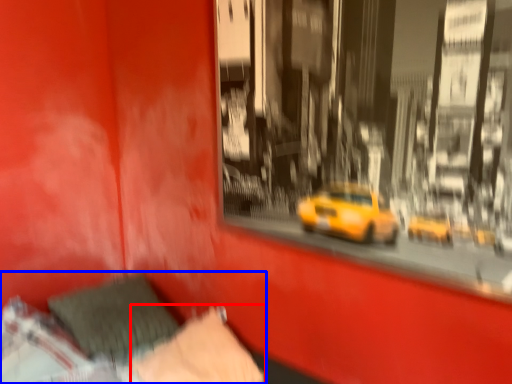
Question: Which point is closer to the camera, pillow (highlighted by a red box) or bed (highlighted by a blue box)?

Choices:
 (A) pillow
 (B) bed

Answer: (B)